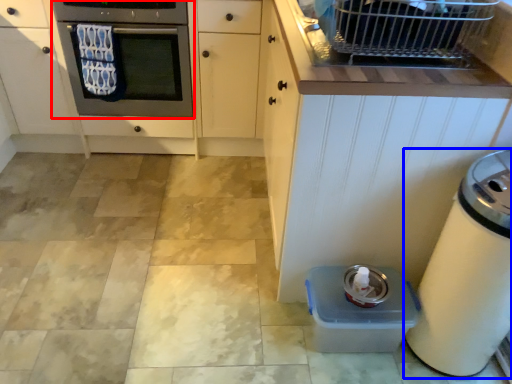
Question: Which object appears farthest to the camera in this image, oven (highlighted by a red box) or home appliance (highlighted by a blue box)?

Choices:
 (A) oven
 (B) home appliance

Answer: (A)